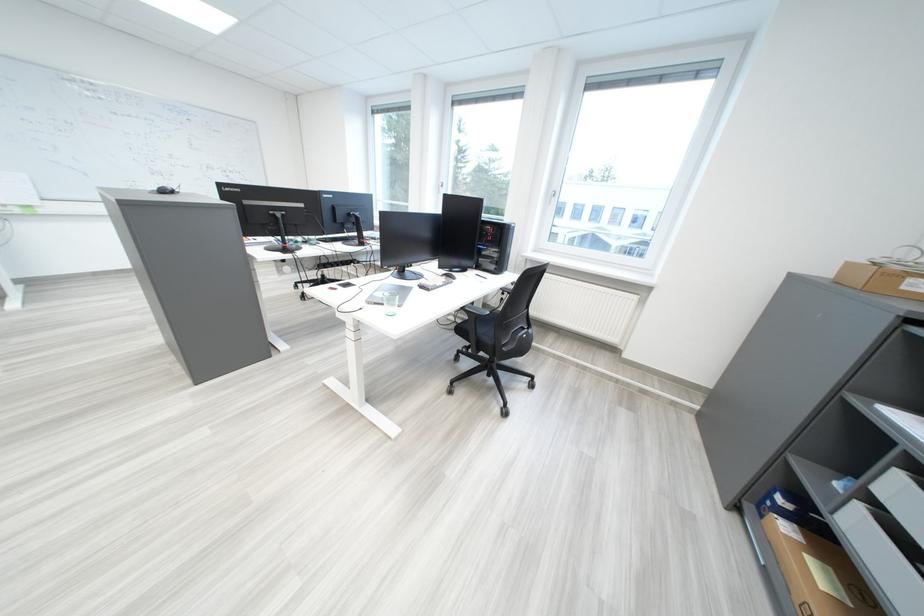
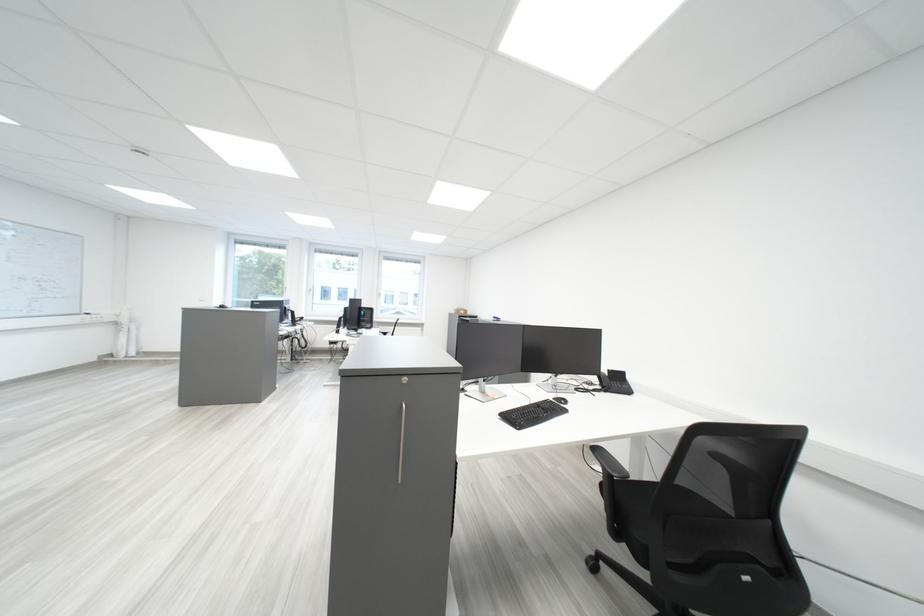
Question: I am providing you with two images of the same scene from different viewpoints. Please identify which objects are invisible in image2.

Choices:
 (A) telephone handset
 (B) chair armrest
 (C) purple water bottle
 (D) silver cabinet handle

Answer: (B)